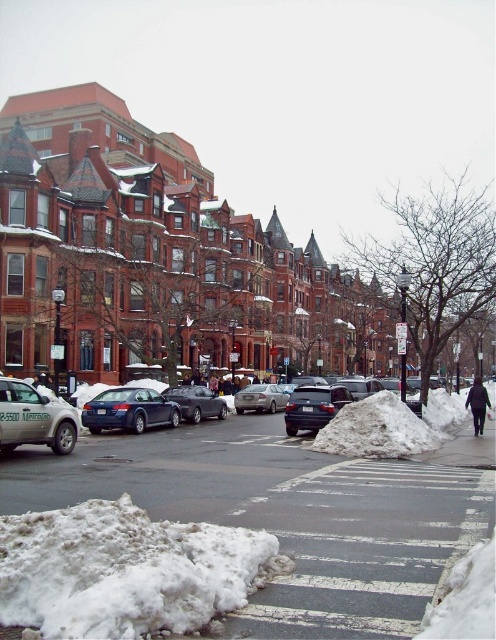
You are a snowplow driver who needs to clear the snow from the street. You observe the white fluffy snow at lower left and the white snow at center. Which area requires more effort to clear based on their height?

The white snow at center requires more effort to clear because it has a greater height than the white fluffy snow at lower left.

You are a delivery driver trying to navigate through the winter scene depicted. There is a satin black sedan at center. Given the snow mounds near the crosswalks and the parked cars, can you safely pass around the sedan without driving on the sidewalks?

The satin black sedan at center is located at point [313,406]. Since the snow mounds are near the crosswalks and the sedan is centrally parked, there might not be enough space to maneuver around it without encroaching on the sidewalks. Proceed with caution or look for an alternative route.

You are standing on the sidewalk and want to take a photo of both the satin black sedan at center and the shiny black sedan at center. Which one should you focus on first to ensure both are in the frame?

You should focus on the satin black sedan at center first since it is closer to you than the shiny black sedan at center, allowing both to be captured in the frame when adjusting the camera angle.